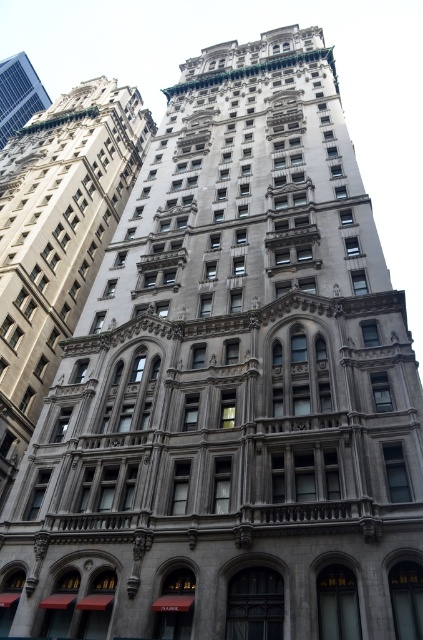
Based on the scene description, can you determine the spatial relationship between the silver metallic building at center and the metallic solar panel at upper left? Specifically, which one is positioned to the right of the other?

The silver metallic building at center is positioned to the right of the metallic solar panel at upper left.

You are standing in front of a grand classical building. There is a point marked at coordinates [57,236]. What does this point indicate?

The point at coordinates [57,236] marks the silver metallic building at center.